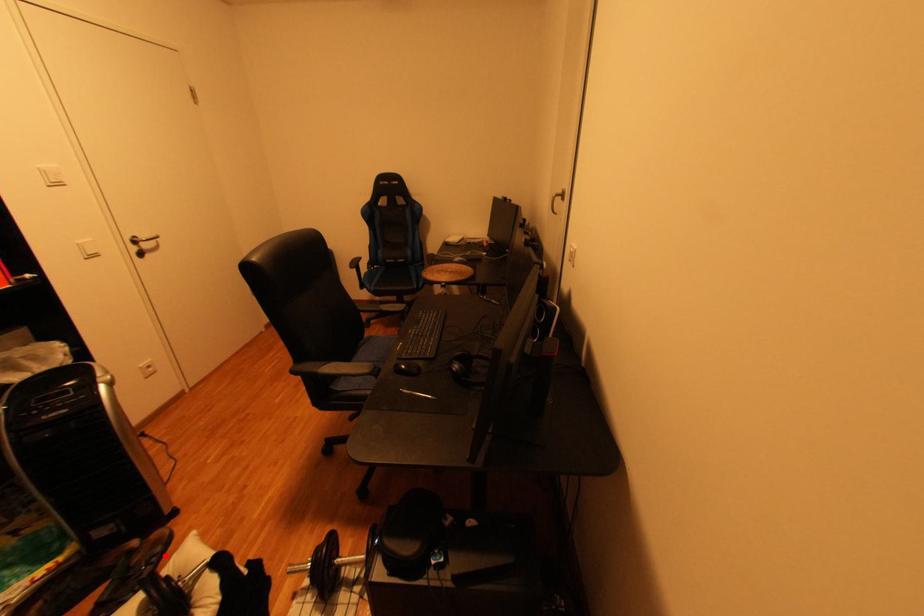
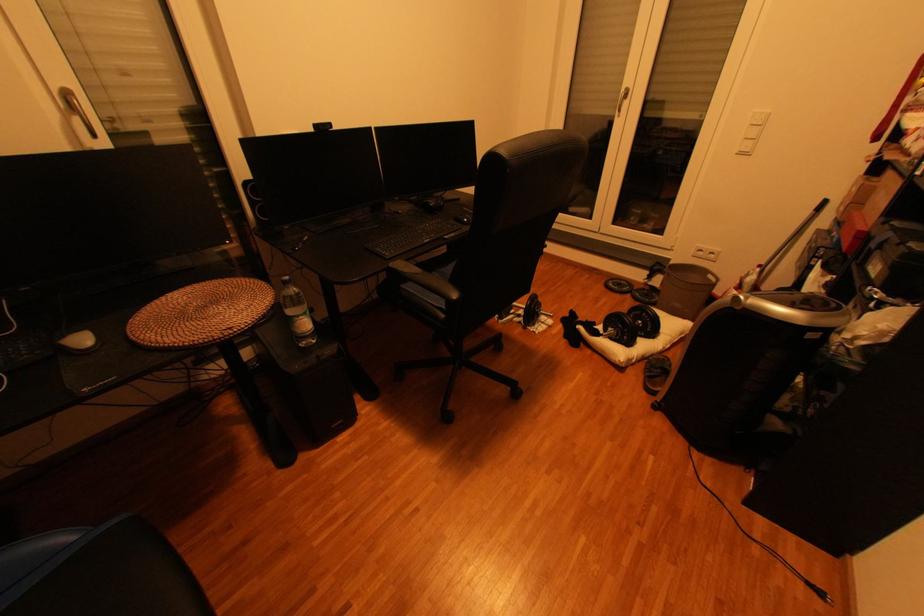
Question: I am providing you with two images of the same scene from different viewpoints. Image1 has a red point marked. In image2, the corresponding 3D location appears at what relative position? Reply with the corresponding letter.

Choices:
 (A) Closer
 (B) Farther

Answer: (A)